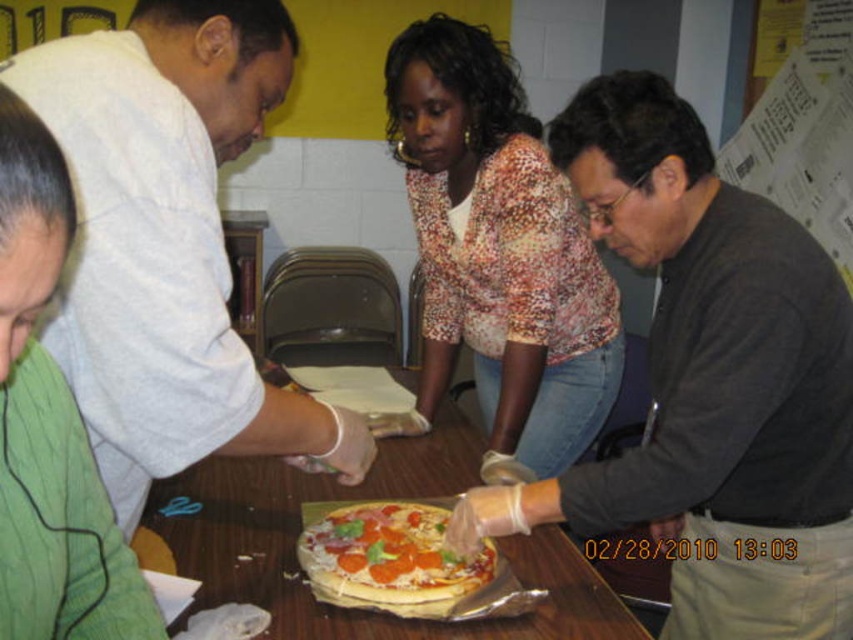
Does white matte shirt at upper left appear on the left side of white paper at upper right?

Yes, white matte shirt at upper left is to the left of white paper at upper right.

Who is taller, white matte shirt at upper left or white paper at upper right?

Standing taller between the two is white paper at upper right.

Image resolution: width=853 pixels, height=640 pixels. Describe the element at coordinates (167, 241) in the screenshot. I see `white matte shirt at upper left` at that location.

Find the location of a particular element. white matte shirt at upper left is located at coordinates (167, 241).

Does printed fabric blouse at center have a greater width compared to wooden table at center?

No, printed fabric blouse at center is not wider than wooden table at center.

Measure the distance between printed fabric blouse at center and wooden table at center.

15.62 inches

Is point (405, 33) positioned after point (448, 444)?

That is False.

Find the location of a particular element. This screenshot has width=853, height=640. printed fabric blouse at center is located at coordinates (497, 252).

Is matte black shirt at center further to camera compared to green textured shirt at lower left?

Yes, it is.

From the picture: Does matte black shirt at center have a lesser width compared to green textured shirt at lower left?

In fact, matte black shirt at center might be wider than green textured shirt at lower left.

Who is more forward, (688, 492) or (0, 250)?

Point (0, 250) is more forward.

You are a GUI agent. You are given a task and a screenshot of the screen. Output one action in this format:
    pyautogui.click(x=<x>, y=<y>)
    Task: Click on the matte black shirt at center
    
    Given the screenshot: What is the action you would take?
    pyautogui.click(x=709, y=381)